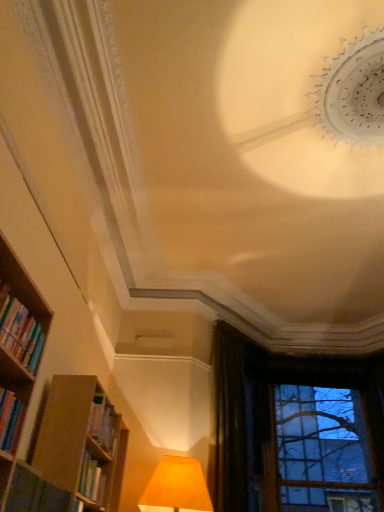
Based on the photo, measure the distance between point (347, 495) and camera.

Point (347, 495) and camera are 5.38 meters apart.

Measure the distance between transparent glass window at lower right and camera.

The distance of transparent glass window at lower right from camera is 5.24 meters.

You are a GUI agent. You are given a task and a screenshot of the screen. Output one action in this format:
    pyautogui.click(x=<x>, y=<y>)
    Task: Click on the hardcover books at left, the first book from the top
    
    Given the screenshot: What is the action you would take?
    pyautogui.click(x=21, y=334)

How distant is hardcover book at lower left, which ranks as the 1th book in bottom-to-top order, from transparent glass window at lower right?

hardcover book at lower left, which ranks as the 1th book in bottom-to-top order, is 4.15 meters away from transparent glass window at lower right.

Which object is positioned more to the left, hardcover book at lower left, which ranks as the 1th book in bottom-to-top order, or transparent glass window at lower right?

From the viewer's perspective, hardcover book at lower left, which ranks as the 1th book in bottom-to-top order, appears more on the left side.

Can transparent glass window at lower right be found inside hardcover book at lower left, the second book when ordered from top to bottom?

Actually, transparent glass window at lower right is outside hardcover book at lower left, the second book when ordered from top to bottom.

In the scene shown: Does hardcover book at lower left, which ranks as the 1th book in bottom-to-top order, have a smaller size compared to transparent glass window at lower right?

Yes.

Is hardcover books at left, the first book from the top, to the right of hardcover book at lower left, the second book when ordered from top to bottom, from the viewer's perspective?

No, hardcover books at left, the first book from the top, is not to the right of hardcover book at lower left, the second book when ordered from top to bottom.

Consider the image. Can you confirm if hardcover books at left, the second book ordered from the bottom, is smaller than hardcover book at lower left, the second book when ordered from top to bottom?

Yes.

From a real-world perspective, is hardcover books at left, the second book ordered from the bottom, above or below hardcover book at lower left, the second book when ordered from top to bottom?

hardcover books at left, the second book ordered from the bottom, is situated higher than hardcover book at lower left, the second book when ordered from top to bottom, in the real world.

Can you tell me how much dark velvet curtain at upper right and hardcover books at left, the second book ordered from the bottom, differ in facing direction?

They differ by 43.5 degrees in their facing directions.

From the image's perspective, which one is positioned higher, dark velvet curtain at upper right or hardcover books at left, the first book from the top?

hardcover books at left, the first book from the top.

Can hardcover books at left, the second book ordered from the bottom, be found inside dark velvet curtain at upper right?

No, hardcover books at left, the second book ordered from the bottom, is not a part of dark velvet curtain at upper right.

Is dark velvet curtain at upper right further to camera compared to hardcover books at left, the second book ordered from the bottom?

Yes, dark velvet curtain at upper right is behind hardcover books at left, the second book ordered from the bottom.

Which object is positioned more to the right, hardcover books at left, the first book from the top, or dark velvet curtain at upper right?

Positioned to the right is dark velvet curtain at upper right.

Which is closer, [5,309] or [242,426]?

The point [5,309] is closer to the camera.

Is hardcover books at left, the second book ordered from the bottom, not near dark velvet curtain at upper right?

Yes, hardcover books at left, the second book ordered from the bottom, is far from dark velvet curtain at upper right.

Looking at this image, from the image's perspective, who appears lower, hardcover books at left, the second book ordered from the bottom, or dark velvet curtain at upper right?

dark velvet curtain at upper right, from the image's perspective.

Could you tell me if dark velvet curtain at upper right is turned towards transparent glass window at lower right?

No, dark velvet curtain at upper right is not facing towards transparent glass window at lower right.

Is dark velvet curtain at upper right positioned far away from transparent glass window at lower right?

Yes, dark velvet curtain at upper right is far from transparent glass window at lower right.

From the image's perspective, is dark velvet curtain at upper right on transparent glass window at lower right?

Yes.

Is the depth of dark velvet curtain at upper right less than that of transparent glass window at lower right?

Yes, dark velvet curtain at upper right is closer to the viewer.

Can you confirm if hardcover books at left, the first book from the top, is thinner than transparent glass window at lower right?

Yes.

From a real-world perspective, is hardcover books at left, the first book from the top, positioned above or below transparent glass window at lower right?

From a real-world perspective, hardcover books at left, the first book from the top, is physically below transparent glass window at lower right.

From the image's perspective, is hardcover books at left, the first book from the top, located beneath transparent glass window at lower right?

No, from the image's perspective, hardcover books at left, the first book from the top, is not beneath transparent glass window at lower right.

Is point (37, 488) positioned in front of point (6, 335)?

No, (37, 488) is behind (6, 335).

Does hardcover book at lower left, the second book when ordered from top to bottom, appear on the left side of hardcover books at left, the second book ordered from the bottom?

No, hardcover book at lower left, the second book when ordered from top to bottom, is not to the left of hardcover books at left, the second book ordered from the bottom.

Is hardcover book at lower left, which ranks as the 1th book in bottom-to-top order, in front of hardcover books at left, the first book from the top?

No, hardcover book at lower left, which ranks as the 1th book in bottom-to-top order, is further to the viewer.

Who is smaller, hardcover book at lower left, which ranks as the 1th book in bottom-to-top order, or hardcover books at left, the second book ordered from the bottom?

hardcover books at left, the second book ordered from the bottom, is smaller.

Starting from the transparent glass window at lower right, which book is the 1st one in front? Please provide its 2D coordinates.

[(34, 493)]

The height and width of the screenshot is (512, 384). Identify the location of book lying on the right of hardcover books at left, the second book ordered from the bottom. (34, 493).

When comparing their distances from hardcover books at left, the first book from the top, does hardcover book at lower left, the second book when ordered from top to bottom, or transparent glass window at lower right seem further?

transparent glass window at lower right.

When comparing their distances from transparent glass window at lower right, does hardcover books at left, the second book ordered from the bottom, or dark velvet curtain at upper right seem closer?

dark velvet curtain at upper right.

Which object lies further to the anchor point hardcover book at lower left, the second book when ordered from top to bottom, hardcover books at left, the second book ordered from the bottom, or transparent glass window at lower right?

The object further to hardcover book at lower left, the second book when ordered from top to bottom, is transparent glass window at lower right.

In the scene shown: Which object lies further to the anchor point transparent glass window at lower right, hardcover book at lower left, which ranks as the 1th book in bottom-to-top order, or dark velvet curtain at upper right?

The object further to transparent glass window at lower right is hardcover book at lower left, which ranks as the 1th book in bottom-to-top order.

Looking at the image, which one is located further to transparent glass window at lower right, hardcover books at left, the second book ordered from the bottom, or hardcover book at lower left, the second book when ordered from top to bottom?

hardcover books at left, the second book ordered from the bottom.

From the image, which object appears to be farther from hardcover book at lower left, which ranks as the 1th book in bottom-to-top order, transparent glass window at lower right or dark velvet curtain at upper right?

Based on the image, transparent glass window at lower right appears to be further to hardcover book at lower left, which ranks as the 1th book in bottom-to-top order.

Considering their positions, is hardcover book at lower left, the second book when ordered from top to bottom, positioned closer to hardcover books at left, the second book ordered from the bottom, than dark velvet curtain at upper right?

hardcover book at lower left, the second book when ordered from top to bottom, lies closer to hardcover books at left, the second book ordered from the bottom, than the other object.

Which object lies further to the anchor point transparent glass window at lower right, dark velvet curtain at upper right or hardcover books at left, the first book from the top?

The object further to transparent glass window at lower right is hardcover books at left, the first book from the top.

The width and height of the screenshot is (384, 512). What are the coordinates of `curtain positioned between hardcover books at left, the first book from the top, and transparent glass window at lower right from near to far` in the screenshot? It's located at (237, 420).

Find the location of a particular element. The image size is (384, 512). book between hardcover books at left, the first book from the top, and dark velvet curtain at upper right in the front-back direction is located at coordinates (34, 493).

Locate an element on the screen. The height and width of the screenshot is (512, 384). book between hardcover books at left, the first book from the top, and transparent glass window at lower right, along the z-axis is located at coordinates (34, 493).

In order to click on curtain located between hardcover book at lower left, which ranks as the 1th book in bottom-to-top order, and transparent glass window at lower right in the depth direction in this screenshot , I will do `click(237, 420)`.